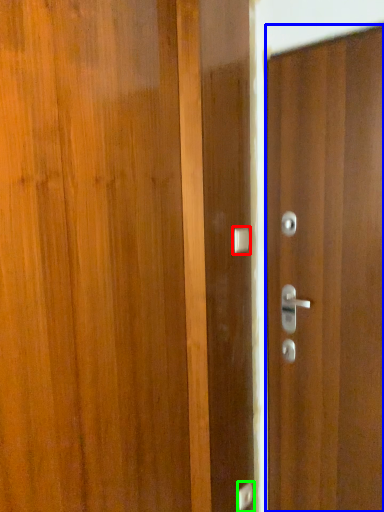
Question: Considering the real-world distances, which object is farthest from door handle (highlighted by a red box)? door (highlighted by a blue box) or door handle (highlighted by a green box)?

Choices:
 (A) door
 (B) door handle

Answer: (B)